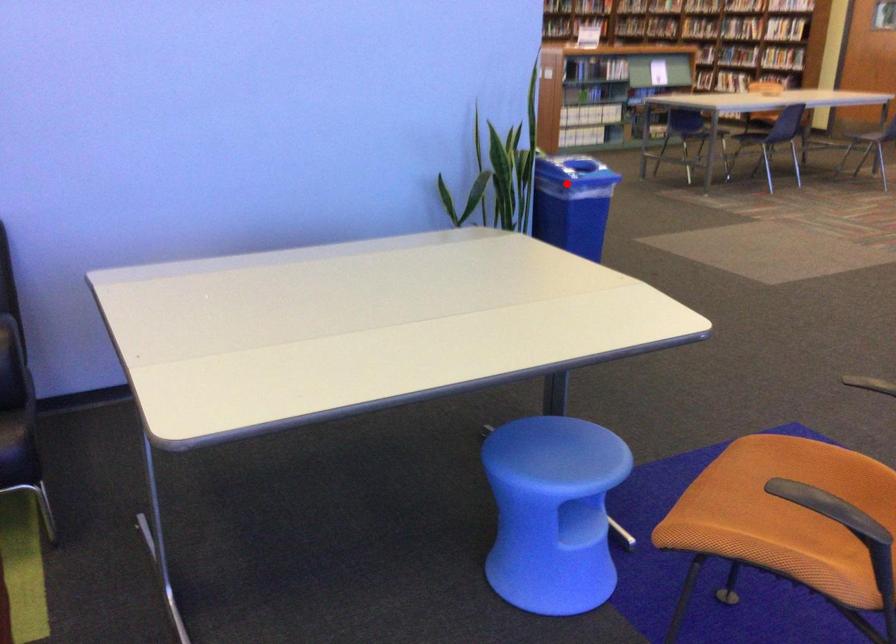
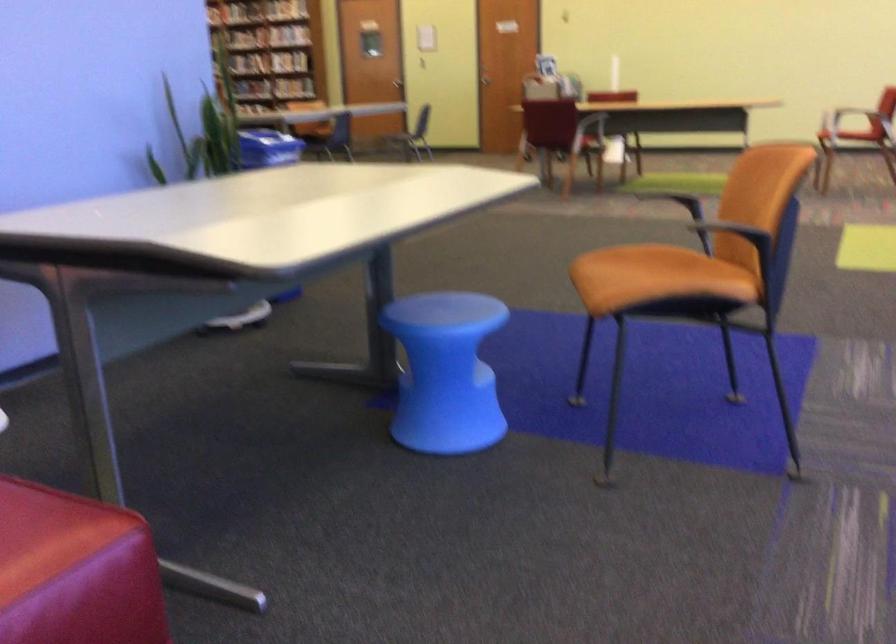
The point at the highlighted location is marked in the first image. Where is the corresponding point in the second image?

(268, 147)